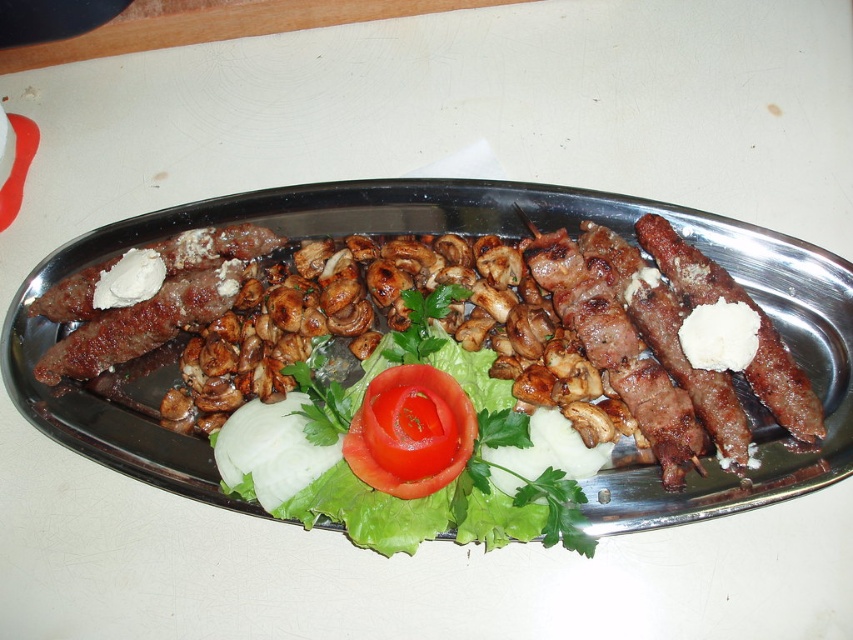
Question: Estimate the real-world distances between objects in this image. Which object is closer to the brown grilled sausage at right?

Choices:
 (A) brown grilled skewers at center
 (B) red smooth tomato at center
 (C) red glossy tomato at center

Answer: (A)

Question: Which object is the farthest from the brown grilled sausage at right?

Choices:
 (A) brown grilled skewers at center
 (B) red glossy tomato at center
 (C) red smooth tomato at center

Answer: (C)

Question: In this image, where is brown grilled skewers at center located relative to red glossy tomato at center?

Choices:
 (A) below
 (B) above

Answer: (B)

Question: Which is nearer to the red smooth tomato at center?

Choices:
 (A) red glossy tomato at center
 (B) brown grilled sausage at right
 (C) brown grilled skewers at center

Answer: (A)

Question: Can you confirm if brown grilled skewers at center is positioned to the left of red smooth tomato at center?

Choices:
 (A) yes
 (B) no

Answer: (B)

Question: Does red glossy tomato at center have a smaller size compared to brown grilled sausage at right?

Choices:
 (A) no
 (B) yes

Answer: (A)